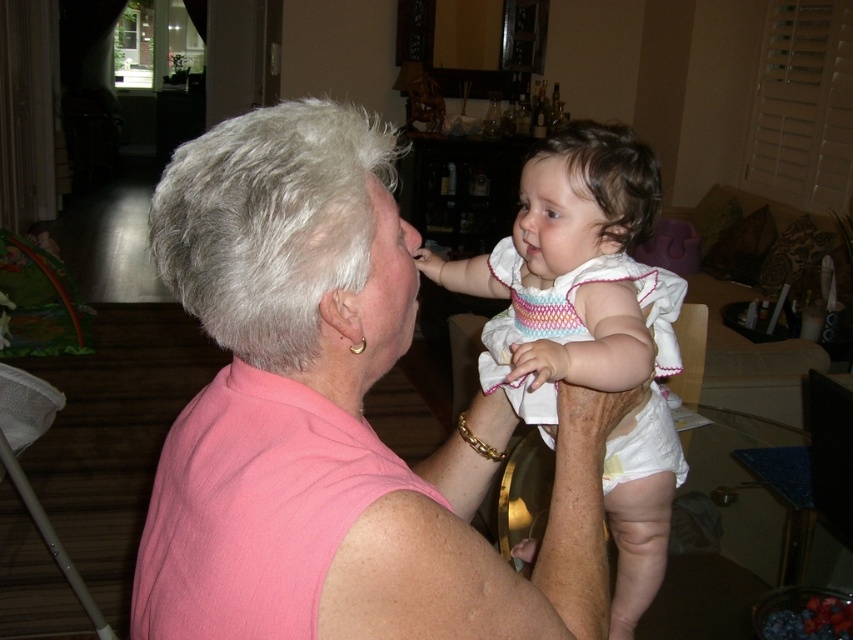
You are a photographer setting up a shoot in this living room. You need to ensure the pink fabric at center and the white knit dress at center are visible in the frame. Which object should you focus on first to capture both in the shot?

The pink fabric at center is positioned over the white knit dress at center, so focusing on the pink fabric at center first will ensure both are visible in the frame.

You are a fashion designer observing the scene. You notice the pink fabric at center and the white knit dress at center. Which one do you think covers more area in the image?

The pink fabric at center is larger in size than the white knit dress at center, so it covers more area in the image.

You are a photographer setting up a shoot in this living room. You need to place a small tripod between the pink fabric at center and the white knit dress at center so that it doesn t block either object. Based on their heights, where should you position the tripod?

The pink fabric at center has a lesser height compared to white knit dress at center. To avoid blocking either object, position the tripod between them at a height that accommodates both, ensuring it is taller than the pink fabric but shorter than the white knit dress.